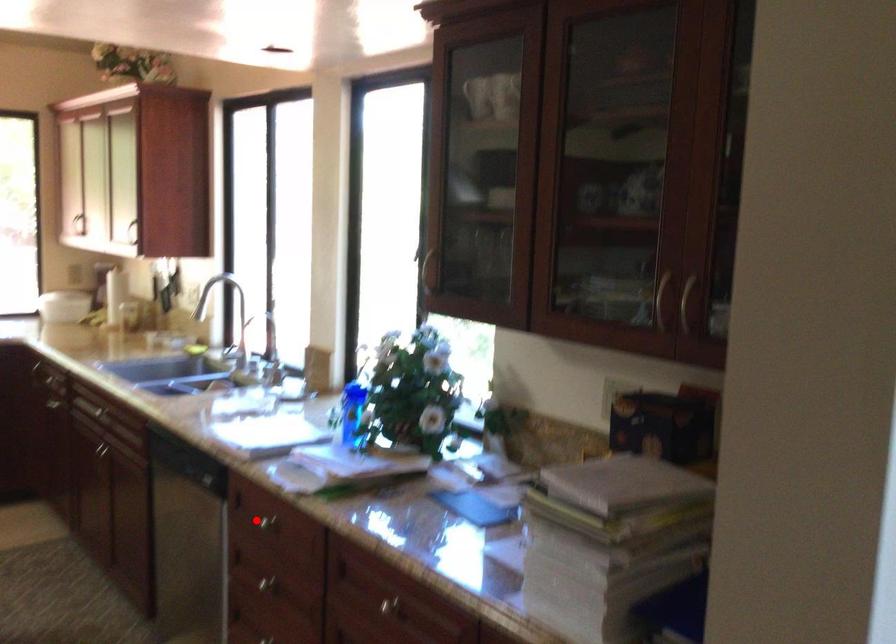
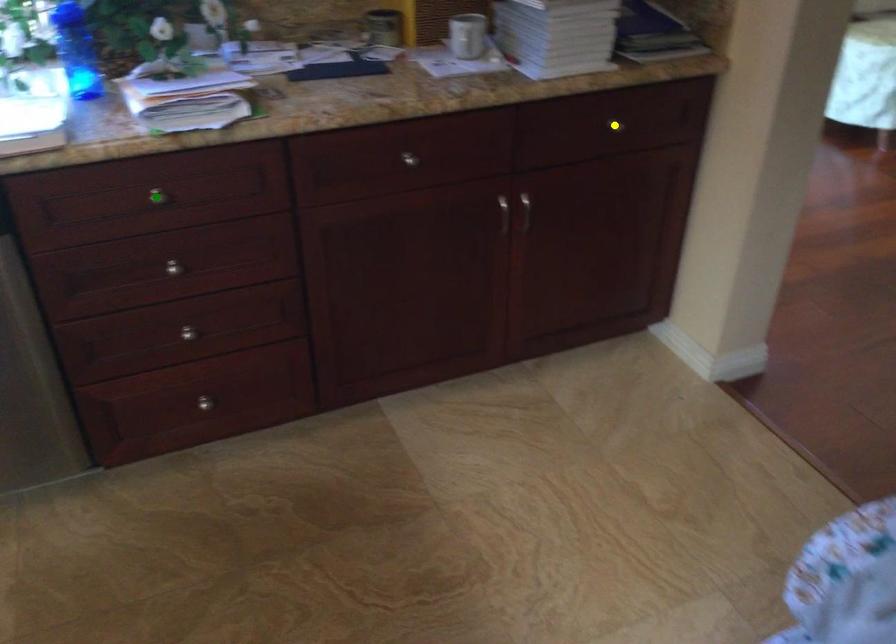
Question: I am providing you with two images of the same scene from different viewpoints. A red point is marked on the first image. You are given multiple points on the second image. Which mark in image 2 goes with the point in image 1?

Choices:
 (A) blue point
 (B) yellow point
 (C) green point

Answer: (C)